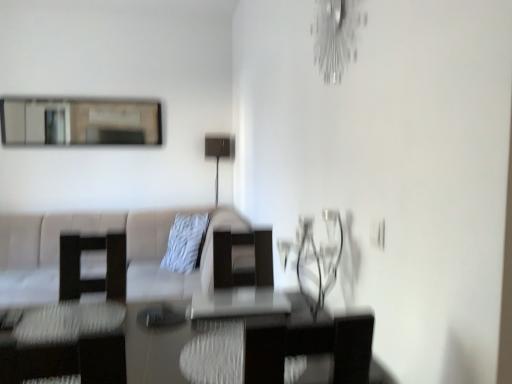
Question: Considering the relative positions of transparent glass table at center and matte glass mirror at upper left in the image provided, is transparent glass table at center to the right of matte glass mirror at upper left from the viewer's perspective?

Choices:
 (A) no
 (B) yes

Answer: (B)

Question: Is transparent glass table at center in contact with matte glass mirror at upper left?

Choices:
 (A) no
 (B) yes

Answer: (A)

Question: Can you confirm if transparent glass table at center is wider than matte glass mirror at upper left?

Choices:
 (A) no
 (B) yes

Answer: (B)

Question: From the image's perspective, does transparent glass table at center appear lower than matte glass mirror at upper left?

Choices:
 (A) yes
 (B) no

Answer: (A)

Question: Could you tell me if transparent glass table at center is facing matte glass mirror at upper left?

Choices:
 (A) yes
 (B) no

Answer: (B)

Question: Looking at the image, does matte glass mirror at upper left seem bigger or smaller compared to transparent glass table at center?

Choices:
 (A) small
 (B) big

Answer: (B)

Question: Would you say matte glass mirror at upper left is to the left or to the right of transparent glass table at center in the picture?

Choices:
 (A) right
 (B) left

Answer: (B)

Question: In the image, is matte glass mirror at upper left positioned in front of or behind transparent glass table at center?

Choices:
 (A) front
 (B) behind

Answer: (B)

Question: From the image's perspective, relative to transparent glass table at center, is matte glass mirror at upper left above or below?

Choices:
 (A) above
 (B) below

Answer: (A)

Question: From a real-world perspective, is metallic silver light fixture at upper right above or below matte glass mirror at upper left?

Choices:
 (A) above
 (B) below

Answer: (A)

Question: From the image's perspective, is metallic silver light fixture at upper right located above or below matte glass mirror at upper left?

Choices:
 (A) above
 (B) below

Answer: (B)

Question: Is metallic silver light fixture at upper right wider or thinner than matte glass mirror at upper left?

Choices:
 (A) wide
 (B) thin

Answer: (B)

Question: Does point (330, 13) appear closer or farther from the camera than point (104, 130)?

Choices:
 (A) closer
 (B) farther

Answer: (A)

Question: Does point (215, 148) appear closer or farther from the camera than point (190, 233)?

Choices:
 (A) closer
 (B) farther

Answer: (B)

Question: Is matte black lamp at center inside the boundaries of white textured pillow at center, or outside?

Choices:
 (A) outside
 (B) inside

Answer: (A)